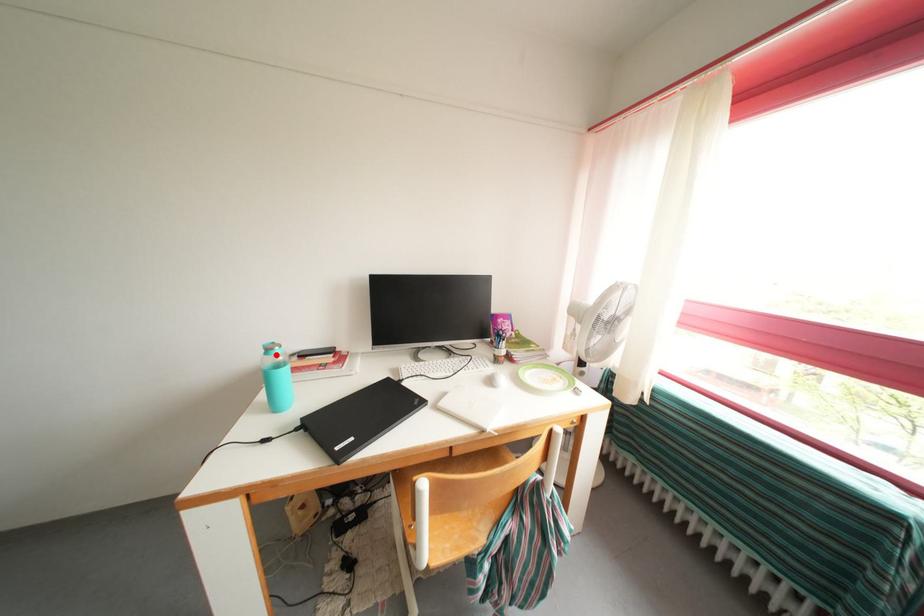
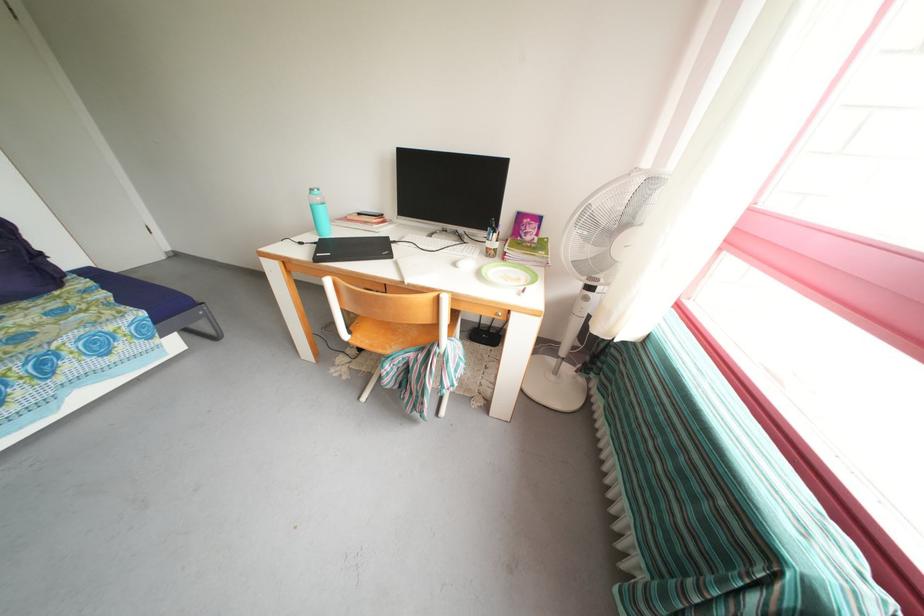
Question: I am providing you with two images of the same scene from different viewpoints. A red point is marked on the first image. Can you still see the location of the red point in image 2?

Choices:
 (A) Yes
 (B) No

Answer: (A)